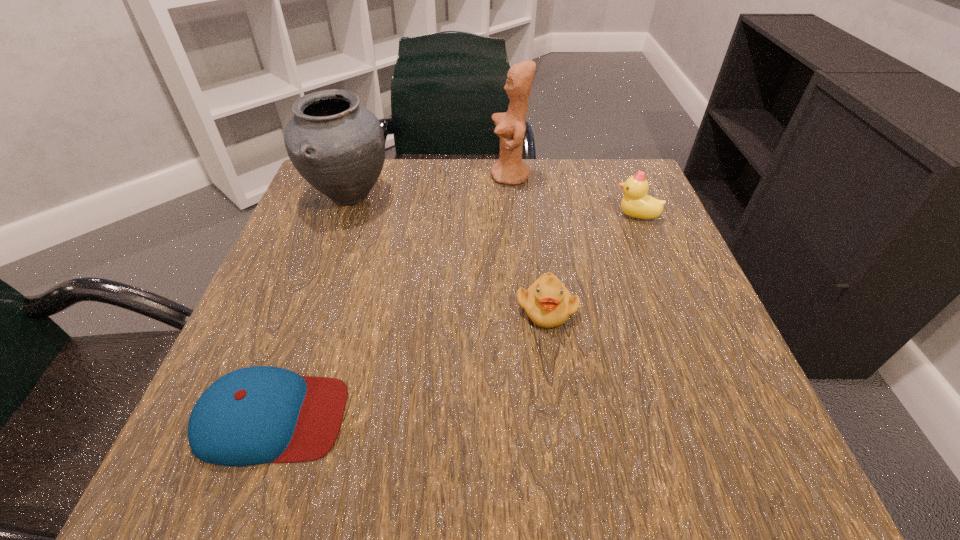
At what (x,y) coordinates should I click in order to perform the action: click on free space at the far left corner of the desktop. Please return your answer as a coordinate pair (x, y). Looking at the image, I should click on (304, 202).

In the image, there is a desktop. At what (x,y) coordinates should I click in order to perform the action: click on vacant space at the far right corner. Please return your answer as a coordinate pair (x, y). The image size is (960, 540). Looking at the image, I should click on (630, 175).

The height and width of the screenshot is (540, 960). I want to click on vacant area at the near right corner, so click(688, 461).

In order to click on vacant area that lies between the fourth farthest object and the taller duckling in this screenshot , I will do [x=591, y=262].

At what (x,y) coordinates should I click in order to perform the action: click on empty location between the urn and the farther duckling. Please return your answer as a coordinate pair (x, y). Looking at the image, I should click on (492, 206).

Identify the location of free space between the farther duckling and the shortest object. This screenshot has height=540, width=960. (454, 316).

Find the location of a particular element. Image resolution: width=960 pixels, height=540 pixels. free space between the nearer duckling and the nearest object is located at coordinates (409, 363).

This screenshot has width=960, height=540. Identify the location of vacant space that's between the fourth shortest object and the fourth tallest object. (448, 252).

At what (x,y) coordinates should I click in order to perform the action: click on vacant space that is in between the shortest object and the urn. Please return your answer as a coordinate pair (x, y). This screenshot has width=960, height=540. Looking at the image, I should click on (311, 307).

This screenshot has height=540, width=960. I want to click on vacant area that lies between the rightmost object and the figurine, so click(573, 196).